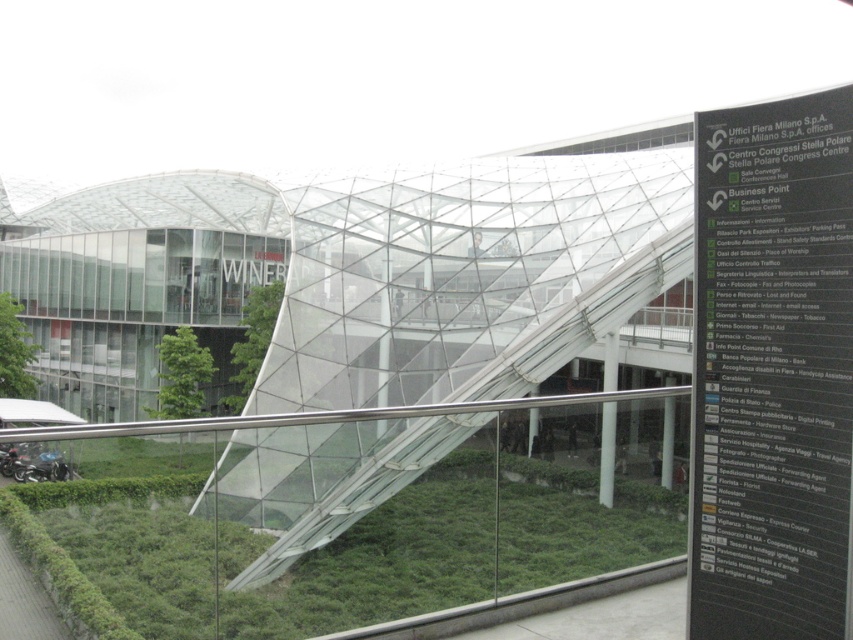
Does black plastic sign at right appear under green leafy tree at lower left?

No.

Who is taller, black plastic sign at right or green leafy tree at lower left?

Standing taller between the two is black plastic sign at right.

Is point (691, 595) more distant than point (0, 348)?

No.

This screenshot has height=640, width=853. Identify the location of black plastic sign at right. (770, 369).

Is black plastic sign at right shorter than green leafy grass at lower center?

In fact, black plastic sign at right may be taller than green leafy grass at lower center.

Is black plastic sign at right wider than green leafy grass at lower center?

No, black plastic sign at right is not wider than green leafy grass at lower center.

Locate an element on the screen. The height and width of the screenshot is (640, 853). black plastic sign at right is located at coordinates (770, 369).

Between point (267, 324) and point (38, 380), which one is positioned in front?

Point (267, 324)

Is green leafy vegetation at center bigger than green leafy tree at lower left?

Correct, green leafy vegetation at center is larger in size than green leafy tree at lower left.

Who is more distant from viewer, (252, 387) or (1, 380)?

The point (1, 380) is more distant.

In order to click on green leafy vegetation at center in this screenshot , I will do `click(252, 340)`.